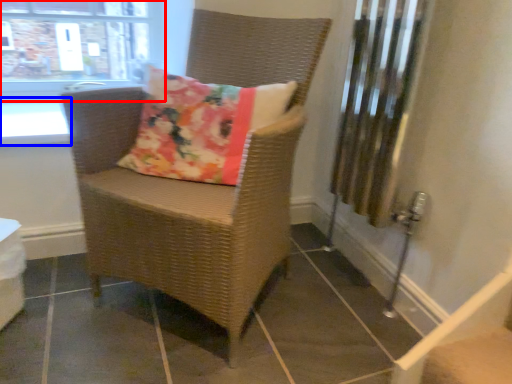
Question: Which point is further to the camera, window (highlighted by a red box) or window sill (highlighted by a blue box)?

Choices:
 (A) window
 (B) window sill

Answer: (A)